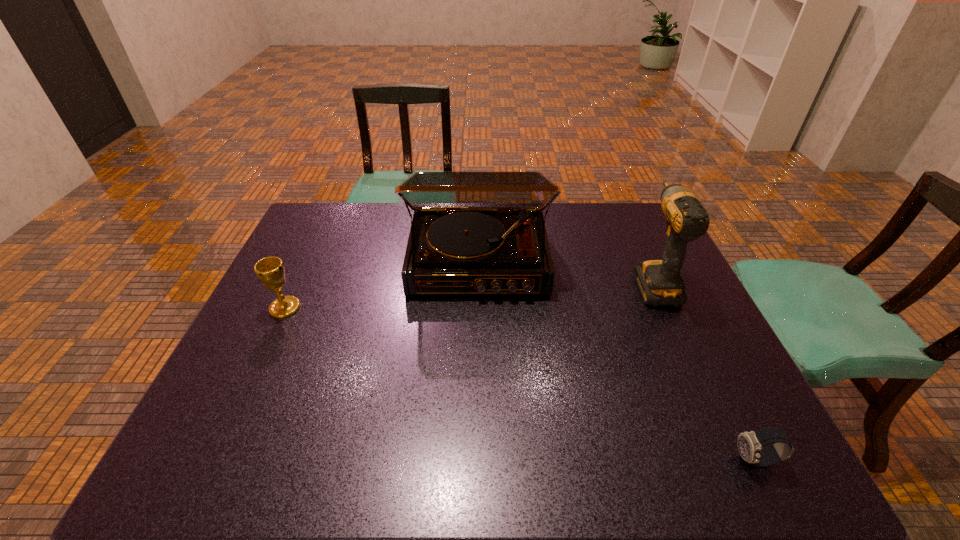
The width and height of the screenshot is (960, 540). I want to click on free area in between the second shortest object and the watch, so click(520, 384).

Locate an element on the screen. vacant area that lies between the third object from right to left and the shortest object is located at coordinates (617, 361).

Image resolution: width=960 pixels, height=540 pixels. I want to click on vacant area between the chalice and the nearest object, so [x=520, y=384].

The image size is (960, 540). What are the coordinates of `free spot between the chalice and the record player` in the screenshot? It's located at (382, 285).

This screenshot has width=960, height=540. In order to click on free spot between the record player and the shortest object in this screenshot , I will do `click(617, 361)`.

At what (x,y) coordinates should I click in order to perform the action: click on free point between the second object from left to right and the shortest object. Please return your answer as a coordinate pair (x, y). Image resolution: width=960 pixels, height=540 pixels. Looking at the image, I should click on (617, 361).

Locate an element on the screen. The width and height of the screenshot is (960, 540). unoccupied area between the nearest object and the third tallest object is located at coordinates (520, 384).

Choose which object is the second nearest neighbor to the drill. Please provide its 2D coordinates. Your answer should be formatted as a tuple, i.e. [(x, y)], where the tuple contains the x and y coordinates of a point satisfying the conditions above.

[(750, 444)]

Find the location of a particular element. Image resolution: width=960 pixels, height=540 pixels. object that is the second nearest to the record player is located at coordinates (270, 270).